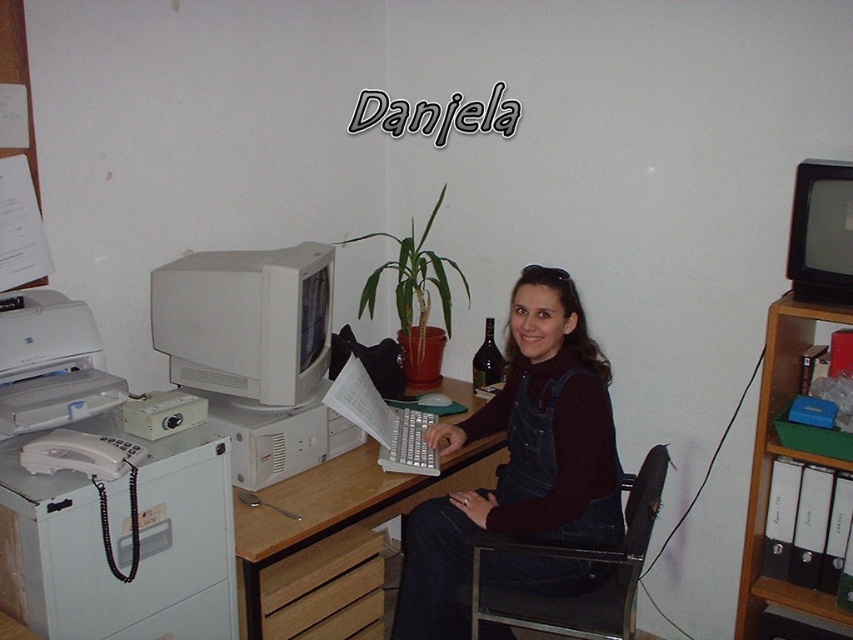
Is point (447, 572) positioned before point (244, 618)?

No, (447, 572) is behind (244, 618).

Is the position of matte black laptop at center less distant than that of wooden at center?

No, it is behind wooden at center.

Who is more forward, (590, 492) or (253, 612)?

Point (253, 612) is in front.

I want to click on matte black laptop at center, so click(520, 458).

What do you see at coordinates (247, 321) in the screenshot?
I see `white matte computer monitor at center-left` at bounding box center [247, 321].

Does white matte computer monitor at center-left appear on the right side of black plastic monitor at upper right?

No, white matte computer monitor at center-left is not to the right of black plastic monitor at upper right.

This screenshot has height=640, width=853. Identify the location of white matte computer monitor at center-left. 247,321.

Does white plastic file cabinet at left appear under white plastic printer at left?

Yes, white plastic file cabinet at left is below white plastic printer at left.

Can you confirm if white plastic file cabinet at left is bigger than white plastic printer at left?

Indeed, white plastic file cabinet at left has a larger size compared to white plastic printer at left.

Is point (56, 483) farther from viewer compared to point (54, 378)?

That is False.

Identify the location of white plastic file cabinet at left. coord(140,545).